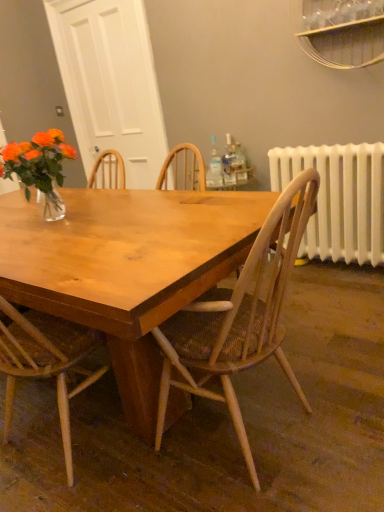
Question: Considering the relative positions of wooden chair at center and clear glass bottle at upper center, the 2th bottle in the left-to-right sequence, in the image provided, is wooden chair at center to the left or to the right of clear glass bottle at upper center, the 2th bottle in the left-to-right sequence,?

Choices:
 (A) right
 (B) left

Answer: (B)

Question: Considering the positions of wooden chair at center and clear glass bottle at upper center, marked as the second bottle in a right-to-left arrangement, in the image, is wooden chair at center bigger or smaller than clear glass bottle at upper center, marked as the second bottle in a right-to-left arrangement,?

Choices:
 (A) small
 (B) big

Answer: (B)

Question: Which object is positioned closest to the translucent plastic bottle at upper right, the 3th bottle positioned from the left?

Choices:
 (A) clear glass bottle at upper center, marked as the second bottle in a right-to-left arrangement
 (B) wooden chair at center
 (C) white plastic radiator at right
 (D) clear glass bottle at center, the 3th bottle when ordered from right to left

Answer: (A)

Question: Estimate the real-world distances between objects in this image. Which object is closer to the wooden chair at center?

Choices:
 (A) clear glass bottle at upper center, the 2th bottle in the left-to-right sequence
 (B) translucent plastic bottle at upper right, which ranks as the first bottle in right-to-left order
 (C) clear glass bottle at center, which is the first bottle from left to right
 (D) white plastic radiator at right

Answer: (D)